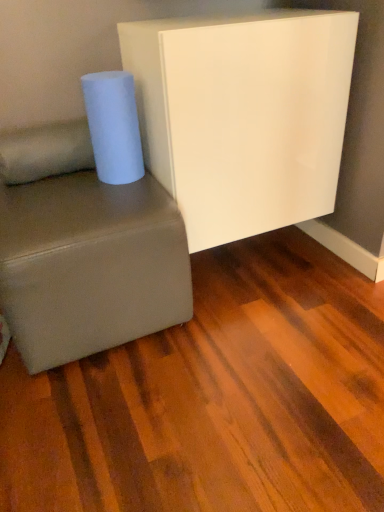
You are a GUI agent. You are given a task and a screenshot of the screen. Output one action in this format:
    pyautogui.click(x=<x>, y=<y>)
    Task: Click on the vacant space to the right of suede-like gray studio couch at lower left
    Image resolution: width=384 pixels, height=512 pixels.
    Given the screenshot: What is the action you would take?
    pyautogui.click(x=258, y=330)